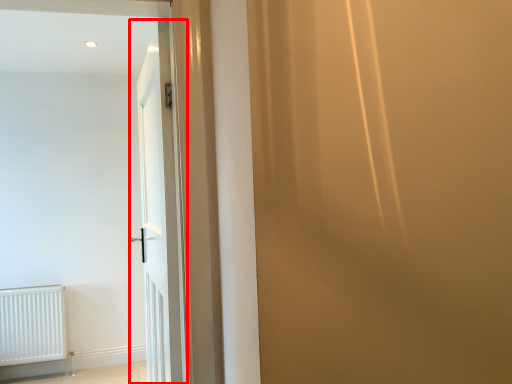
Question: From the image's perspective, what is the correct spatial relationship of door (annotated by the red box) in relation to radiator?

Choices:
 (A) below
 (B) above

Answer: (B)